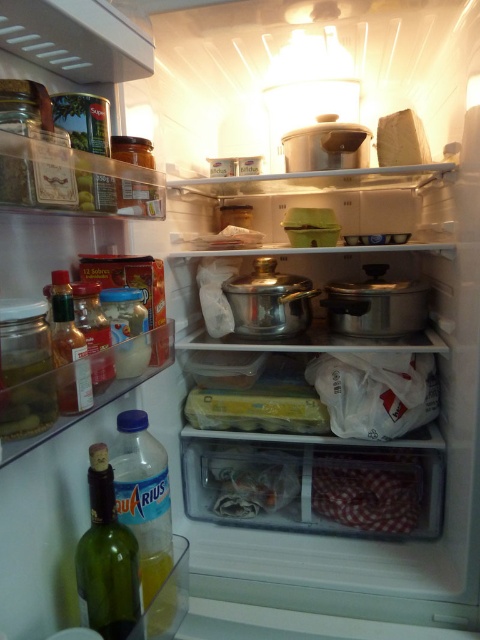
Can you confirm if translucent glass bottle at left is smaller than translucent plastic bottle at center-left?

Correct, translucent glass bottle at left occupies less space than translucent plastic bottle at center-left.

Does translucent glass bottle at left have a greater width compared to translucent plastic bottle at center-left?

Yes, translucent glass bottle at left is wider than translucent plastic bottle at center-left.

At what (x,y) coordinates should I click in order to perform the action: click on translucent glass bottle at left. Please return your answer as a coordinate pair (x, y). Looking at the image, I should click on (69, 348).

Is clear plastic bottle at lower left thinner than green glass bottle at lower left?

In fact, clear plastic bottle at lower left might be wider than green glass bottle at lower left.

Is point (168, 497) positioned before point (82, 541)?

No, (168, 497) is further to viewer.

In order to click on clear plastic bottle at lower left in this screenshot , I will do `click(145, 512)`.

Based on the photo, does green glass bottle at lower left come in front of translucent plastic bottle at center-left?

No, it is not.

Image resolution: width=480 pixels, height=640 pixels. What are the coordinates of `green glass bottle at lower left` in the screenshot? It's located at (107, 557).

Where is `green glass bottle at lower left`? green glass bottle at lower left is located at coordinates (107, 557).